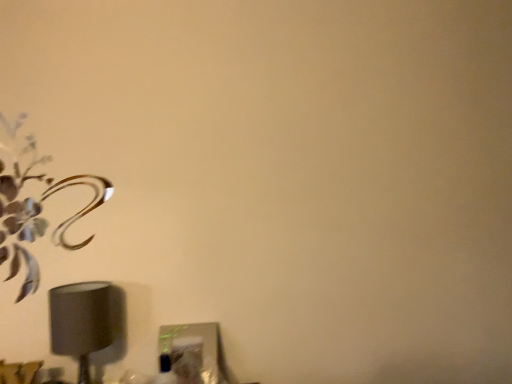
Question: From the image's perspective, is metallic silver flower at upper left located above matte gray lampshade at lower left?

Choices:
 (A) yes
 (B) no

Answer: (A)

Question: Is metallic silver flower at upper left closer to camera compared to matte gray lampshade at lower left?

Choices:
 (A) no
 (B) yes

Answer: (A)

Question: Is metallic silver flower at upper left looking in the opposite direction of matte gray lampshade at lower left?

Choices:
 (A) yes
 (B) no

Answer: (B)

Question: Does metallic silver flower at upper left appear on the right side of matte gray lampshade at lower left?

Choices:
 (A) no
 (B) yes

Answer: (A)

Question: Is metallic silver flower at upper left positioned beyond the bounds of matte gray lampshade at lower left?

Choices:
 (A) yes
 (B) no

Answer: (A)

Question: Can you confirm if metallic silver flower at upper left is positioned to the left of matte gray lampshade at lower left?

Choices:
 (A) yes
 (B) no

Answer: (A)

Question: Can you confirm if matte gray lampshade at lower left is positioned to the right of metallic silver flower at upper left?

Choices:
 (A) yes
 (B) no

Answer: (A)

Question: Is matte gray lampshade at lower left shorter than metallic silver flower at upper left?

Choices:
 (A) yes
 (B) no

Answer: (A)

Question: Can you confirm if matte gray lampshade at lower left is wider than metallic silver flower at upper left?

Choices:
 (A) yes
 (B) no

Answer: (A)

Question: Could you tell me if matte gray lampshade at lower left is facing metallic silver flower at upper left?

Choices:
 (A) no
 (B) yes

Answer: (A)

Question: Is matte gray lampshade at lower left looking in the opposite direction of metallic silver flower at upper left?

Choices:
 (A) no
 (B) yes

Answer: (A)

Question: Does matte gray lampshade at lower left have a smaller size compared to metallic silver flower at upper left?

Choices:
 (A) no
 (B) yes

Answer: (A)

Question: Does point (106, 183) appear closer or farther from the camera than point (61, 352)?

Choices:
 (A) farther
 (B) closer

Answer: (A)